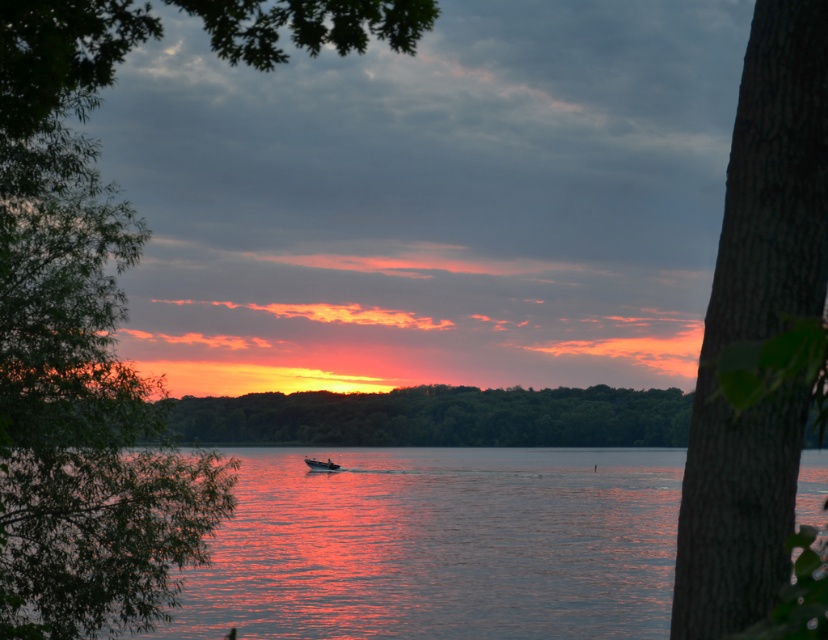
Question: Is green leafy tree at left smaller than brown rough bark tree at right?

Choices:
 (A) no
 (B) yes

Answer: (A)

Question: Does brown rough bark tree at right have a smaller size compared to metallic silver boat at center?

Choices:
 (A) no
 (B) yes

Answer: (A)

Question: Estimate the real-world distances between objects in this image. Which object is farther from the reflective water at center?

Choices:
 (A) metallic silver boat at center
 (B) brown rough bark tree at right
 (C) green leafy tree at left

Answer: (B)

Question: In this image, where is green leafy tree at left located relative to brown rough bark tree at right?

Choices:
 (A) right
 (B) left

Answer: (B)

Question: Which is farther from the green leafy tree at left?

Choices:
 (A) reflective water at center
 (B) brown rough bark tree at right
 (C) metallic silver boat at center
 (D) green leafy tree at center

Answer: (C)

Question: Which of the following is the closest to the observer?

Choices:
 (A) reflective water at center
 (B) brown rough bark tree at right
 (C) metallic silver boat at center
 (D) green leafy tree at left

Answer: (B)